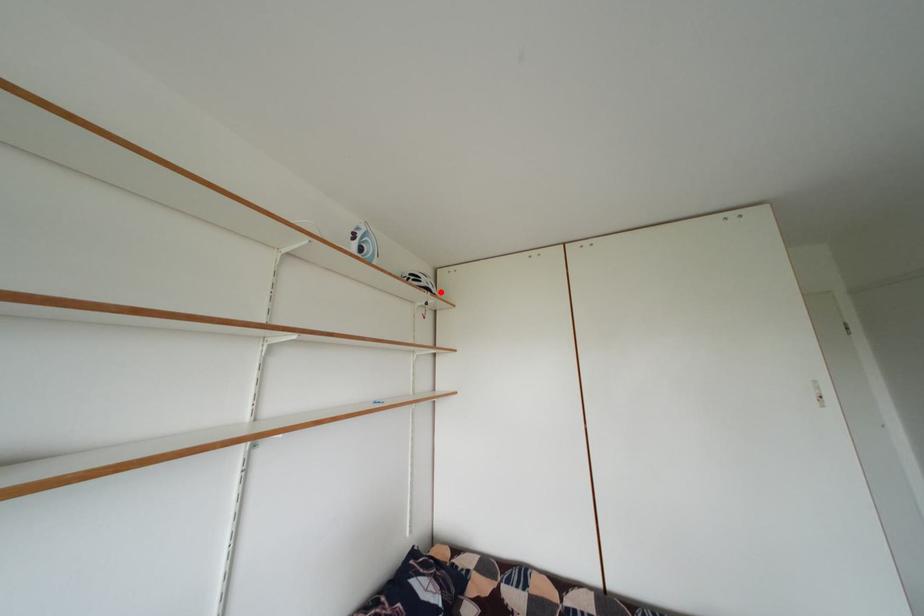
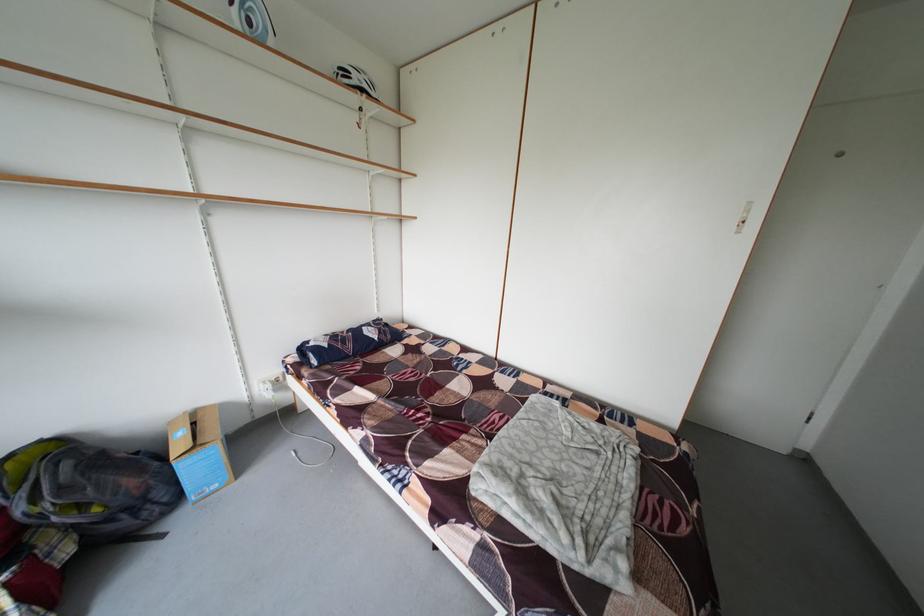
Where in the second image is the point corresponding to the highlighted location from the first image?

(375, 92)